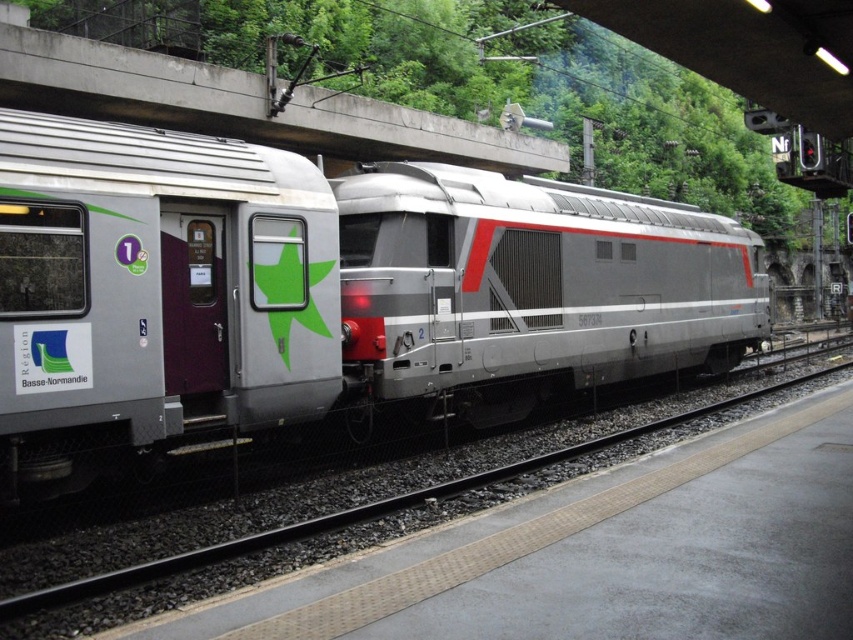
What is the spatial relationship between the silver metallic locomotive at center and the metal track at center?

The silver metallic locomotive at center is to the left of the metal track at center.